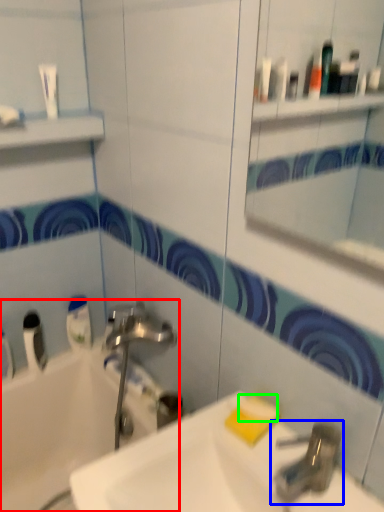
Question: Which object is positioned closest to bathtub (highlighted by a red box)? Select from tap (highlighted by a blue box) and soap (highlighted by a green box).

Choices:
 (A) tap
 (B) soap

Answer: (B)